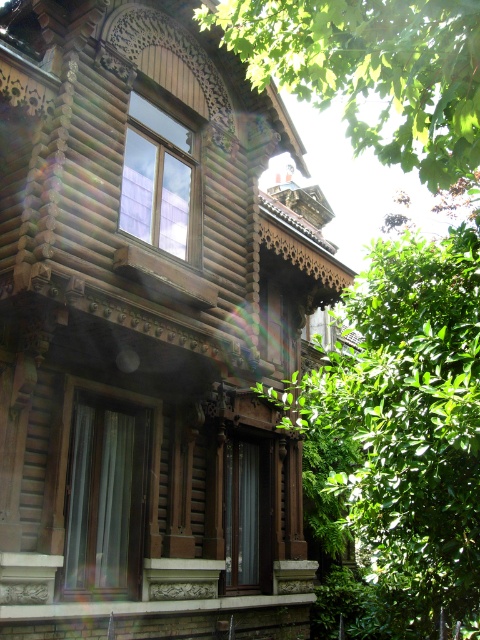
Looking at this image, you are standing in front of the wooden house and want to water the green leafy tree at center. Your watering can has a maximum reach of 5 meters. Can you water the tree without moving closer?

The green leafy tree at center is 4.96 meters away from the viewer. Since the watering can has a maximum reach of 5 meters, you can water the tree without moving closer.

You are a gardener planning to plant a new tree between the green leafy tree at center and the green leafy tree at upper center. The new tree requires a minimum of 5 meters of space between it and the existing trees. Is there enough space between the two existing trees to accommodate the new tree?

The green leafy tree at center and green leafy tree at upper center are 6.08 meters apart, which is more than the required 5 meters. Therefore, there is enough space to plant the new tree between them.